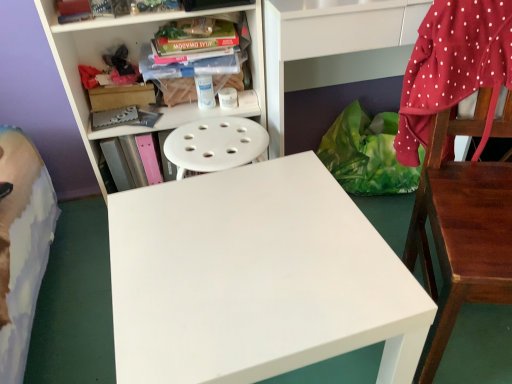
Question: From the image's perspective, does wooden chair at right appear lower than green plastic bag at lower right?

Choices:
 (A) yes
 (B) no

Answer: (A)

Question: Is wooden chair at right surrounding green plastic bag at lower right?

Choices:
 (A) yes
 (B) no

Answer: (B)

Question: Does wooden chair at right have a greater height compared to green plastic bag at lower right?

Choices:
 (A) no
 (B) yes

Answer: (B)

Question: Is the depth of wooden chair at right greater than that of green plastic bag at lower right?

Choices:
 (A) yes
 (B) no

Answer: (B)

Question: Does wooden chair at right have a larger size compared to green plastic bag at lower right?

Choices:
 (A) no
 (B) yes

Answer: (B)

Question: Considering the relative positions of pink matte book at center-left, the 1th book from the bottom, and wooden chair at right in the image provided, is pink matte book at center-left, the 1th book from the bottom, to the left or to the right of wooden chair at right?

Choices:
 (A) left
 (B) right

Answer: (A)

Question: From the image's perspective, is pink matte book at center-left, which is counted as the second book, starting from the top, above or below wooden chair at right?

Choices:
 (A) below
 (B) above

Answer: (B)

Question: Is point (152, 139) closer or farther from the camera than point (436, 150)?

Choices:
 (A) farther
 (B) closer

Answer: (A)

Question: Looking at the image, does pink matte book at center-left, the 1th book from the bottom, seem bigger or smaller compared to wooden chair at right?

Choices:
 (A) big
 (B) small

Answer: (B)

Question: Is white plastic bookcase at upper left spatially inside pink matte book at center-left, which is counted as the second book, starting from the top, or outside of it?

Choices:
 (A) inside
 (B) outside

Answer: (B)

Question: From the image's perspective, relative to pink matte book at center-left, which is counted as the second book, starting from the top, is white plastic bookcase at upper left above or below?

Choices:
 (A) above
 (B) below

Answer: (A)

Question: In terms of size, does white plastic bookcase at upper left appear bigger or smaller than pink matte book at center-left, the 1th book from the bottom?

Choices:
 (A) small
 (B) big

Answer: (B)

Question: In the image, is white plastic bookcase at upper left positioned in front of or behind pink matte book at center-left, the 1th book from the bottom?

Choices:
 (A) behind
 (B) front

Answer: (B)

Question: From a real-world perspective, is wooden chair at right above or below red polka dot fabric at right?

Choices:
 (A) above
 (B) below

Answer: (B)

Question: Considering the positions of point (417, 188) and point (492, 56), is point (417, 188) closer or farther from the camera than point (492, 56)?

Choices:
 (A) closer
 (B) farther

Answer: (B)